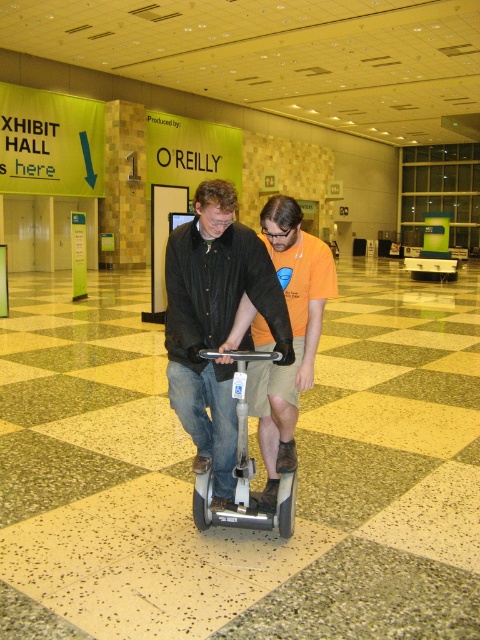
From the picture: You are standing at the entrance of the convention center and see two points marked in the scene. Which point, point [208,380] or point [308,260], is closer to you?

Point [208,380] is closer to the viewer than point [308,260].

You are a visitor at the convention center and need to move your belongings from the silver metallic scooter at center to the matte black scooter at center. Considering their positions, which scooter should you approach first?

You should approach the matte black scooter at center first because the silver metallic scooter at center is behind it, making the matte black scooter more accessible.